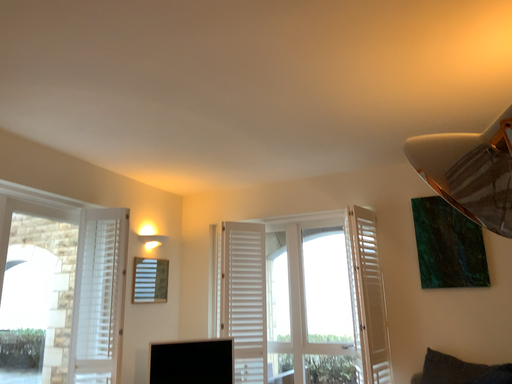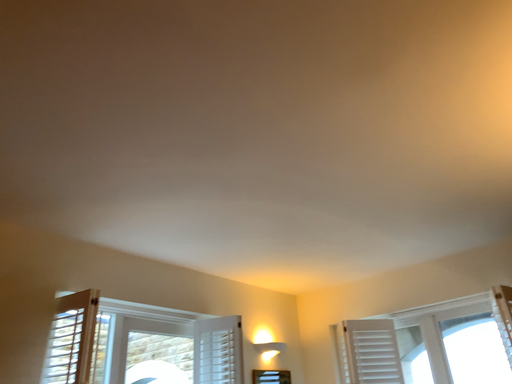
Question: Which way did the camera rotate in the video?

Choices:
 (A) rotated downward
 (B) rotated upward

Answer: (B)